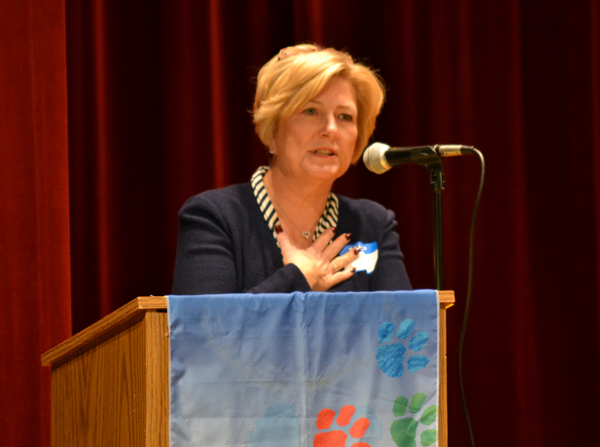
I want to click on cable, so click(x=482, y=174).